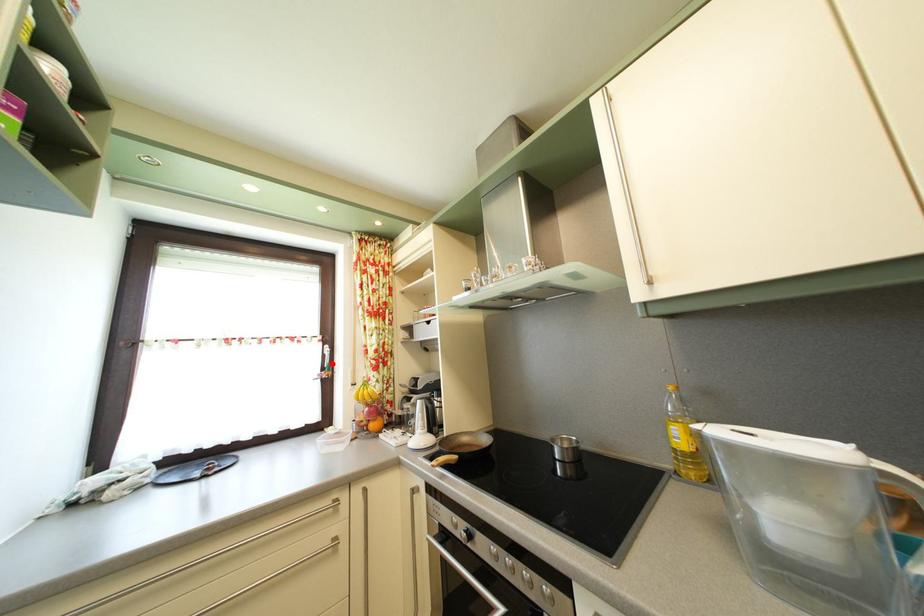
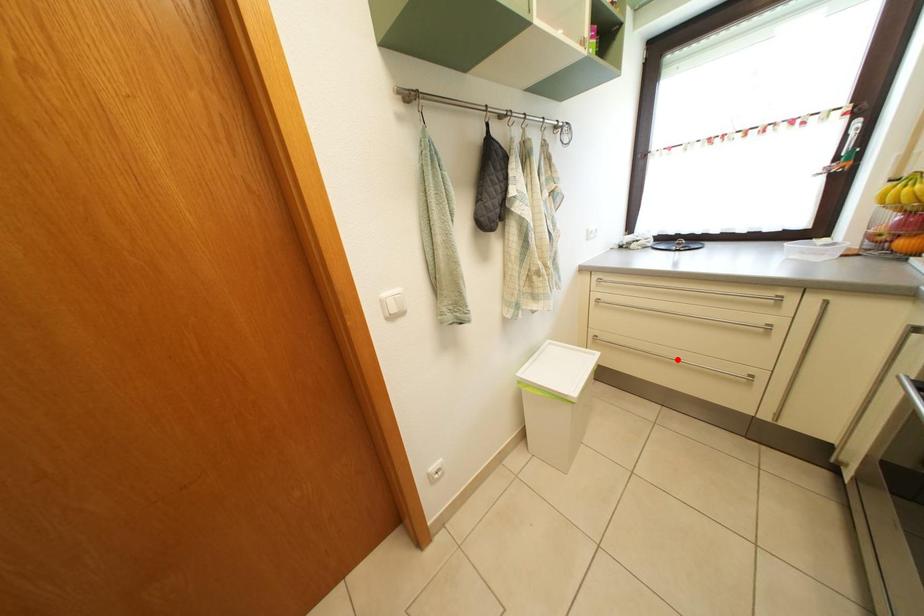
I am providing you with two images of the same scene from different viewpoints. A red point is marked on the first image and another point is marked on the second image. Do the highlighted points in image1 and image2 indicate the same real-world spot?

No